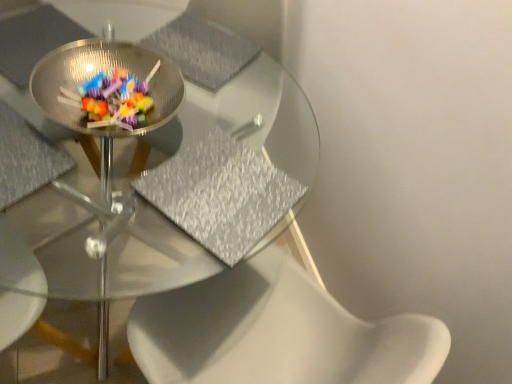
Question: Does clear glass bowl at center have a lesser height compared to metallic silver chair at center?

Choices:
 (A) yes
 (B) no

Answer: (B)

Question: Does clear glass bowl at center lie in front of metallic silver chair at center?

Choices:
 (A) no
 (B) yes

Answer: (A)

Question: Is clear glass bowl at center thinner than metallic silver chair at center?

Choices:
 (A) no
 (B) yes

Answer: (A)

Question: Is clear glass bowl at center facing away from metallic silver chair at center?

Choices:
 (A) yes
 (B) no

Answer: (B)

Question: From a real-world perspective, is clear glass bowl at center below metallic silver chair at center?

Choices:
 (A) no
 (B) yes

Answer: (A)

Question: From the image's perspective, is clear glass bowl at center positioned above or below transparent glass table at center?

Choices:
 (A) above
 (B) below

Answer: (A)

Question: Relative to transparent glass table at center, is clear glass bowl at center in front or behind?

Choices:
 (A) front
 (B) behind

Answer: (B)

Question: Is clear glass bowl at center bigger or smaller than transparent glass table at center?

Choices:
 (A) big
 (B) small

Answer: (B)

Question: From a real-world perspective, is clear glass bowl at center physically located above or below transparent glass table at center?

Choices:
 (A) below
 (B) above

Answer: (B)

Question: Is metallic silver chair at center wider or thinner than clear glass bowl at center?

Choices:
 (A) thin
 (B) wide

Answer: (A)

Question: Looking at the image, does metallic silver chair at center seem bigger or smaller compared to clear glass bowl at center?

Choices:
 (A) small
 (B) big

Answer: (A)

Question: From their relative heights in the image, would you say metallic silver chair at center is taller or shorter than clear glass bowl at center?

Choices:
 (A) tall
 (B) short

Answer: (B)

Question: Is point (57, 148) positioned closer to the camera than point (139, 51)?

Choices:
 (A) closer
 (B) farther

Answer: (A)

Question: Is point (230, 107) positioned closer to the camera than point (28, 193)?

Choices:
 (A) closer
 (B) farther

Answer: (B)

Question: Considering the positions of transparent glass table at center and metallic silver chair at center in the image, is transparent glass table at center taller or shorter than metallic silver chair at center?

Choices:
 (A) short
 (B) tall

Answer: (B)